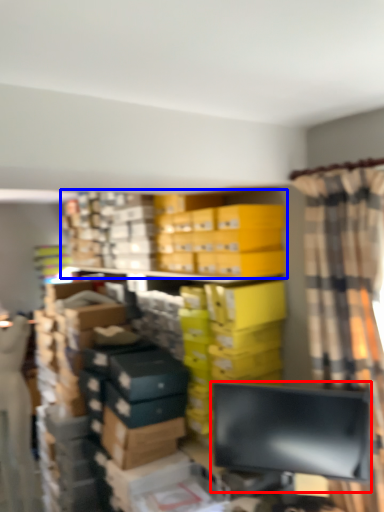
Question: Among these objects, which one is nearest to the camera, computer monitor (highlighted by a red box) or bookcase (highlighted by a blue box)?

Choices:
 (A) computer monitor
 (B) bookcase

Answer: (A)